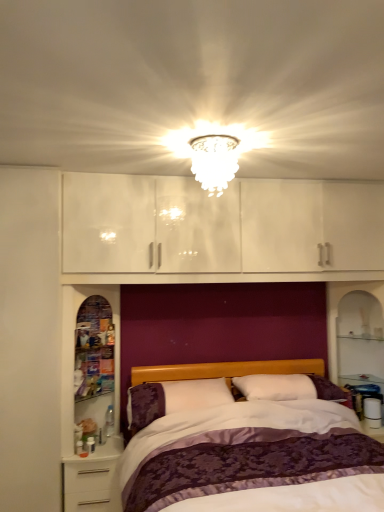
Measure the distance between point (x=79, y=502) and camera.

The depth of point (x=79, y=502) is 8.83 feet.

Locate an element on the screen. The width and height of the screenshot is (384, 512). white glass chandelier at upper center is located at coordinates (214, 161).

In order to face purple satin bed at center, should I rotate leftwards or rightwards?

Rotate right and turn 12.079 degrees.

Where is `white glossy nightstand at lower left`? The height and width of the screenshot is (512, 384). white glossy nightstand at lower left is located at coordinates (93, 479).

Which object is wider, white glass chandelier at upper center or purple satin bed at center?

Wider between the two is purple satin bed at center.

How different are the orientations of white glass chandelier at upper center and purple satin bed at center in degrees?

1.22 degrees separate the facing orientations of white glass chandelier at upper center and purple satin bed at center.

Which is correct: white glass chandelier at upper center is inside purple satin bed at center, or outside of it?

white glass chandelier at upper center lies outside purple satin bed at center.

Is white glass chandelier at upper center behind purple satin bed at center?

Yes, it is behind purple satin bed at center.

Does purple satin bed at center touch white glossy nightstand at lower left?

purple satin bed at center and white glossy nightstand at lower left are not in contact.

Can you confirm if purple satin bed at center is positioned to the left of white glossy nightstand at lower left?

No, purple satin bed at center is not to the left of white glossy nightstand at lower left.

Does purple satin bed at center turn towards white glossy nightstand at lower left?

No, purple satin bed at center is not aimed at white glossy nightstand at lower left.

Can we say purple satin bed at center lies outside white glossy nightstand at lower left?

purple satin bed at center lies outside white glossy nightstand at lower left's area.

Is purple satin bed at center to the left or to the right of white soft pillow at center in the image?

purple satin bed at center is to the right of white soft pillow at center.

Is purple satin bed at center completely or partially outside of white soft pillow at center?

Yes, purple satin bed at center is not within white soft pillow at center.

How many degrees apart are the facing directions of purple satin bed at center and white soft pillow at center?

There is a 0.331-degree angle between the facing directions of purple satin bed at center and white soft pillow at center.

Between point (294, 466) and point (206, 390), which one is positioned in front?

The point (294, 466) is more forward.

Which object is further away from the camera, white soft pillow at center or white glass chandelier at upper center?

white soft pillow at center is more distant.

Is white soft pillow at center outside of white glass chandelier at upper center?

Yes, white soft pillow at center is outside of white glass chandelier at upper center.

From a real-world perspective, is white soft pillow at center on top of white glass chandelier at upper center?

No, from a real-world perspective, white soft pillow at center is not above white glass chandelier at upper center.

Considering the sizes of objects white soft pillow at center and white glass chandelier at upper center in the image provided, who is bigger, white soft pillow at center or white glass chandelier at upper center?

Bigger between the two is white soft pillow at center.

Is white glossy nightstand at lower left wider than purple satin bed at center?

No, white glossy nightstand at lower left is not wider than purple satin bed at center.

Is white glossy nightstand at lower left positioned before purple satin bed at center?

No, white glossy nightstand at lower left is further to the viewer.

Looking at this image, is white glossy nightstand at lower left bigger than purple satin bed at center?

No.

Considering the positions of objects white glossy nightstand at lower left and purple satin bed at center in the image provided, who is more to the right, white glossy nightstand at lower left or purple satin bed at center?

Positioned to the right is purple satin bed at center.

Locate an element on the screen. The width and height of the screenshot is (384, 512). cabinet on the left of purple satin bed at center is located at coordinates (74, 352).

Visually, is purple satin bed at center positioned to the left or to the right of transparent glass cabinet at left?

purple satin bed at center is to the right of transparent glass cabinet at left.

Which is nearer, (329, 489) or (112, 297)?

Point (329, 489) is positioned closer to the camera compared to point (112, 297).

In the scene shown: Is white glossy nightstand at lower left at the back of white soft pillow at center?

No, white glossy nightstand at lower left is not at the back of white soft pillow at center.

Is white glossy nightstand at lower left inside white soft pillow at center?

No, white soft pillow at center does not contain white glossy nightstand at lower left.

Which object is positioned more to the right, white soft pillow at center or white glossy nightstand at lower left?

white soft pillow at center is more to the right.

Locate an element on the screen. This screenshot has width=384, height=512. pillow on the right of the white glossy nightstand at lower left is located at coordinates (173, 399).

You are a GUI agent. You are given a task and a screenshot of the screen. Output one action in this format:
    pyautogui.click(x=<x>, y=<y>)
    Task: Click on the light fixture above the purple satin bed at center (from a real-world perspective)
    
    Given the screenshot: What is the action you would take?
    pyautogui.click(x=214, y=161)

Find the location of a particular element. bed in front of the white glossy nightstand at lower left is located at coordinates (246, 444).

Based on their spatial positions, is white glossy nightstand at lower left or white glass chandelier at upper center further from white soft pillow at center?

The object further to white soft pillow at center is white glass chandelier at upper center.

Estimate the real-world distances between objects in this image. Which object is further from white glossy nightstand at lower left, white soft pillow at center or purple satin bed at center?

purple satin bed at center lies further to white glossy nightstand at lower left than the other object.

Estimate the real-world distances between objects in this image. Which object is closer to white soft pillow at center, purple satin bed at center or transparent glass cabinet at left?

purple satin bed at center lies closer to white soft pillow at center than the other object.

Looking at the image, which one is located closer to purple satin bed at center, transparent glass cabinet at left or white glossy nightstand at lower left?

white glossy nightstand at lower left is closer to purple satin bed at center.

Looking at this image, from the image, which object appears to be nearer to purple satin bed at center, white soft pillow at center or transparent glass cabinet at left?

Based on the image, white soft pillow at center appears to be nearer to purple satin bed at center.

Estimate the real-world distances between objects in this image. Which object is closer to white glossy nightstand at lower left, white glass chandelier at upper center or white soft pillow at center?

white soft pillow at center.

Based on their spatial positions, is white soft pillow at center or white glossy nightstand at lower left further from white glass chandelier at upper center?

Among the two, white glossy nightstand at lower left is located further to white glass chandelier at upper center.

Looking at this image, estimate the real-world distances between objects in this image. Which object is further from white soft pillow at center, white glossy nightstand at lower left or purple satin bed at center?

white glossy nightstand at lower left is positioned further to the anchor white soft pillow at center.

At what (x,y) coordinates should I click in order to perform the action: click on pillow between transparent glass cabinet at left and white glossy nightstand at lower left from top to bottom. Please return your answer as a coordinate pair (x, y). Looking at the image, I should click on (173, 399).

At what (x,y) coordinates should I click in order to perform the action: click on pillow between white glass chandelier at upper center and white glossy nightstand at lower left in the vertical direction. Please return your answer as a coordinate pair (x, y). The width and height of the screenshot is (384, 512). Looking at the image, I should click on (173, 399).

Identify the location of nightstand between purple satin bed at center and transparent glass cabinet at left along the z-axis. (93, 479).

You are a GUI agent. You are given a task and a screenshot of the screen. Output one action in this format:
    pyautogui.click(x=<x>, y=<y>)
    Task: Click on the cabinet between white glass chandelier at upper center and white soft pillow at center in the up-down direction
    
    Given the screenshot: What is the action you would take?
    pyautogui.click(x=74, y=352)